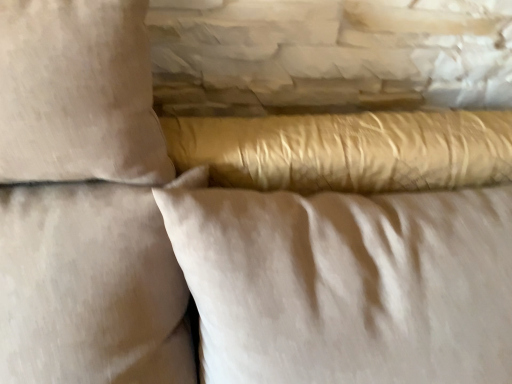
Question: Is the depth of beige cotton pillow at upper left, acting as the second pillow starting from the left, less than that of beige fabric pillow at upper left, marked as the first pillow in a left-to-right arrangement?

Choices:
 (A) no
 (B) yes

Answer: (A)

Question: Is beige cotton pillow at upper left, marked as the second pillow in a right-to-left arrangement, smaller than beige fabric pillow at upper left, which is counted as the 3th pillow, starting from the right?

Choices:
 (A) no
 (B) yes

Answer: (B)

Question: Are beige cotton pillow at upper left, acting as the second pillow starting from the left, and beige fabric pillow at upper left, which is counted as the 3th pillow, starting from the right, located far from each other?

Choices:
 (A) no
 (B) yes

Answer: (A)

Question: Is beige cotton pillow at upper left, marked as the second pillow in a right-to-left arrangement, placed right next to beige fabric pillow at upper left, which is counted as the 3th pillow, starting from the right?

Choices:
 (A) no
 (B) yes

Answer: (A)

Question: Could you tell me if beige cotton pillow at upper left, marked as the second pillow in a right-to-left arrangement, is facing beige fabric pillow at upper left, which is counted as the 3th pillow, starting from the right?

Choices:
 (A) yes
 (B) no

Answer: (A)

Question: In terms of size, does beige cotton pillow at upper left, acting as the second pillow starting from the left, appear bigger or smaller than satin gold pillow at center, the first pillow in the right-to-left sequence?

Choices:
 (A) big
 (B) small

Answer: (B)

Question: From a real-world perspective, is beige cotton pillow at upper left, marked as the second pillow in a right-to-left arrangement, above or below satin gold pillow at center, which ranks as the 3th pillow in left-to-right order?

Choices:
 (A) below
 (B) above

Answer: (B)

Question: Would you say beige cotton pillow at upper left, acting as the second pillow starting from the left, is inside or outside satin gold pillow at center, which ranks as the 3th pillow in left-to-right order?

Choices:
 (A) inside
 (B) outside

Answer: (A)

Question: Is beige cotton pillow at upper left, acting as the second pillow starting from the left, wider or thinner than satin gold pillow at center, which ranks as the 3th pillow in left-to-right order?

Choices:
 (A) thin
 (B) wide

Answer: (A)

Question: Is beige fabric pillow at upper left, marked as the first pillow in a left-to-right arrangement, spatially inside beige cotton pillow at upper left, marked as the second pillow in a right-to-left arrangement, or outside of it?

Choices:
 (A) inside
 (B) outside

Answer: (B)

Question: From a real-world perspective, relative to beige cotton pillow at upper left, acting as the second pillow starting from the left, is beige fabric pillow at upper left, marked as the first pillow in a left-to-right arrangement, vertically above or below?

Choices:
 (A) below
 (B) above

Answer: (A)

Question: In terms of width, does beige fabric pillow at upper left, which is counted as the 3th pillow, starting from the right, look wider or thinner when compared to beige cotton pillow at upper left, acting as the second pillow starting from the left?

Choices:
 (A) wide
 (B) thin

Answer: (A)

Question: In the image, is beige fabric pillow at upper left, which is counted as the 3th pillow, starting from the right, positioned in front of or behind beige cotton pillow at upper left, marked as the second pillow in a right-to-left arrangement?

Choices:
 (A) front
 (B) behind

Answer: (A)

Question: In terms of size, does beige fabric pillow at upper left, which is counted as the 3th pillow, starting from the right, appear bigger or smaller than satin gold pillow at center, the first pillow in the right-to-left sequence?

Choices:
 (A) small
 (B) big

Answer: (A)

Question: From a real-world perspective, is beige fabric pillow at upper left, marked as the first pillow in a left-to-right arrangement, above or below satin gold pillow at center, the first pillow in the right-to-left sequence?

Choices:
 (A) below
 (B) above

Answer: (B)